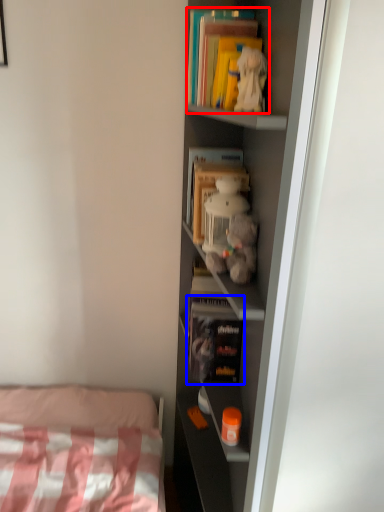
Question: Which of the following is the closest to the observer, book (highlighted by a red box) or book (highlighted by a blue box)?

Choices:
 (A) book
 (B) book

Answer: (A)